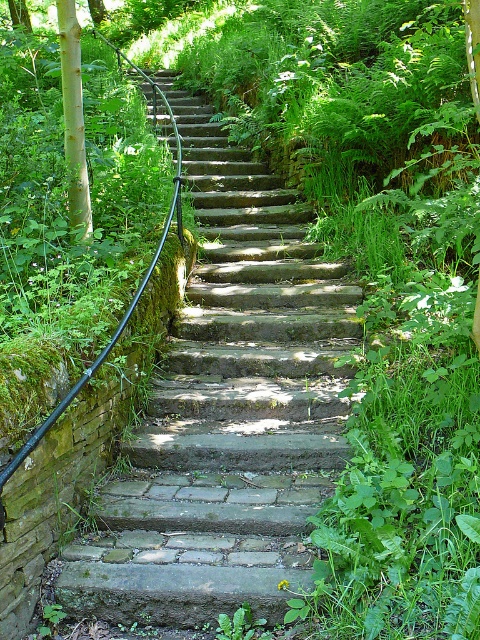
Question: Which point is farther from the camera taking this photo?

Choices:
 (A) (72, 177)
 (B) (192, 362)

Answer: (B)

Question: Which point is closer to the camera taking this photo?

Choices:
 (A) (68, 154)
 (B) (223, 280)

Answer: (A)

Question: Is natural stone stairs at center above smooth light brown tree trunk at left?

Choices:
 (A) no
 (B) yes

Answer: (A)

Question: Is natural stone stairs at center smaller than smooth light brown tree trunk at left?

Choices:
 (A) no
 (B) yes

Answer: (A)

Question: Is natural stone stairs at center below smooth light brown tree trunk at left?

Choices:
 (A) yes
 (B) no

Answer: (A)